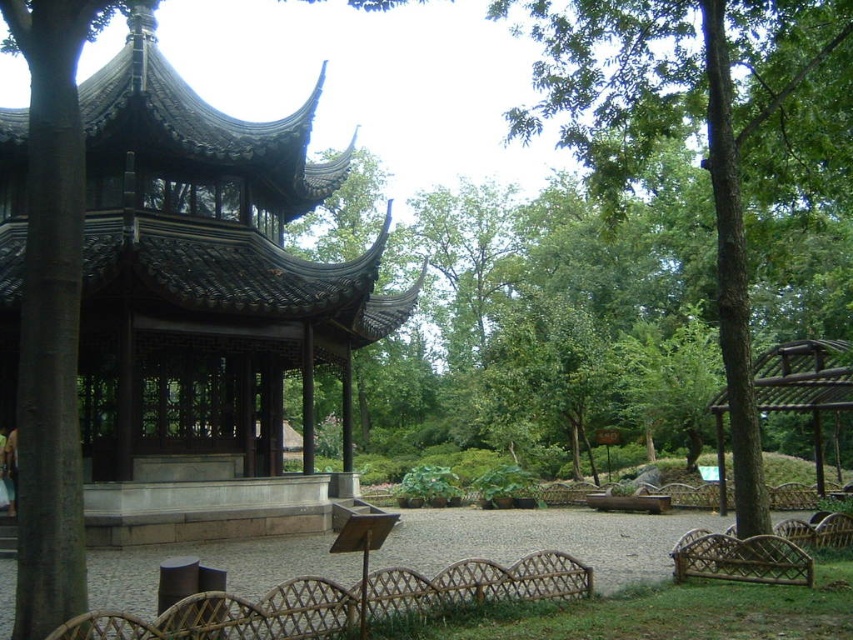
Question: Does dark brown wood gazebo at center appear on the left side of green leafy tree at center?

Choices:
 (A) no
 (B) yes

Answer: (B)

Question: Does dark brown wood gazebo at center appear under green leafy tree at center?

Choices:
 (A) yes
 (B) no

Answer: (A)

Question: Which point appears closest to the camera in this image?

Choices:
 (A) (663, 74)
 (B) (305, 275)

Answer: (A)

Question: Does dark brown wood gazebo at center appear on the left side of green leafy tree at center?

Choices:
 (A) yes
 (B) no

Answer: (A)

Question: Which point is closer to the camera?

Choices:
 (A) dark brown wood gazebo at center
 (B) green leafy tree at center

Answer: (A)